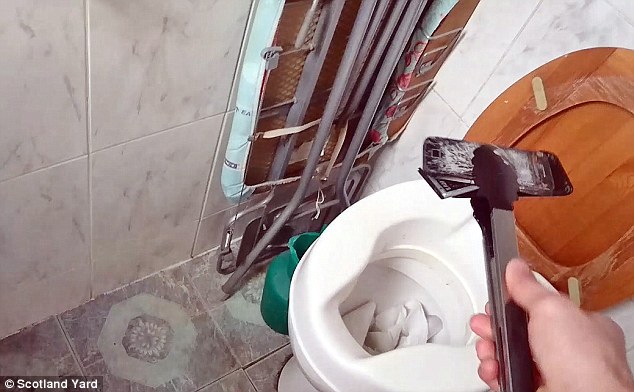
Locate an element on the screen. This screenshot has height=392, width=634. jar is located at coordinates (273, 297).